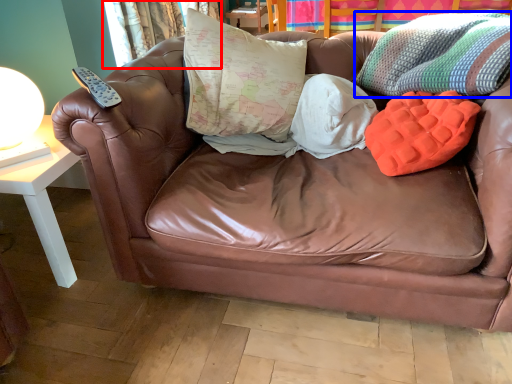
Question: Which of the following is the closest to the observer, curtain (highlighted by a red box) or throw pillow (highlighted by a blue box)?

Choices:
 (A) curtain
 (B) throw pillow

Answer: (B)